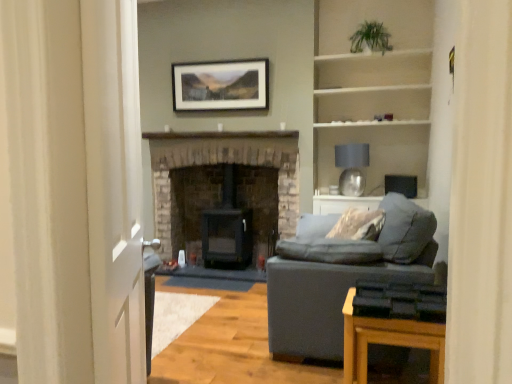
Question: Would you say green leafy plant at upper right is to the left or to the right of white wooden shelves at upper right in the picture?

Choices:
 (A) left
 (B) right

Answer: (A)

Question: Is point (361, 46) closer or farther from the camera than point (352, 97)?

Choices:
 (A) closer
 (B) farther

Answer: (A)

Question: Which object is the closest to the satin silver lampshade at upper right?

Choices:
 (A) matte black picture frame at upper center
 (B) wooden table at lower right
 (C) green leafy plant at upper right
 (D) black matte fireplace at center, which ranks as the first fireplace in right-to-left order
 (E) brick fireplace at center, arranged as the 1th fireplace when viewed from the left

Answer: (E)

Question: Estimate the real-world distances between objects in this image. Which object is closer to the white wooden shelves at upper right?

Choices:
 (A) black matte fireplace at center, positioned as the second fireplace in left-to-right order
 (B) white glossy door at left
 (C) brick fireplace at center, positioned as the second fireplace in right-to-left order
 (D) green leafy plant at upper right
 (E) matte gray fabric couch at right

Answer: (D)